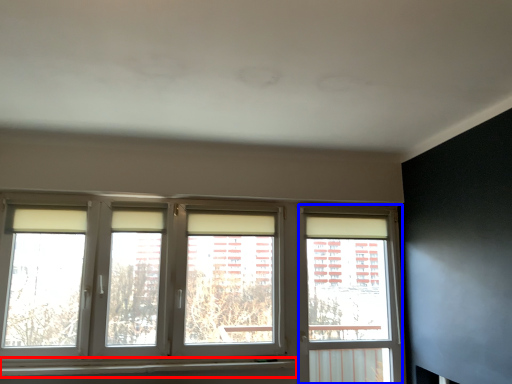
Question: Which point is closer to the camera, window sill (highlighted by a red box) or window frame (highlighted by a blue box)?

Choices:
 (A) window sill
 (B) window frame

Answer: (A)